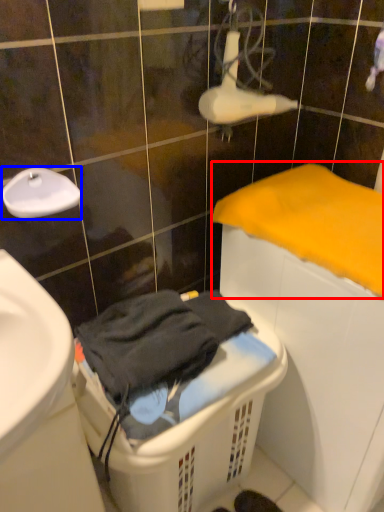
Question: Which object is further to the camera taking this photo, bath towel (highlighted by a red box) or faucet (highlighted by a blue box)?

Choices:
 (A) bath towel
 (B) faucet

Answer: (B)